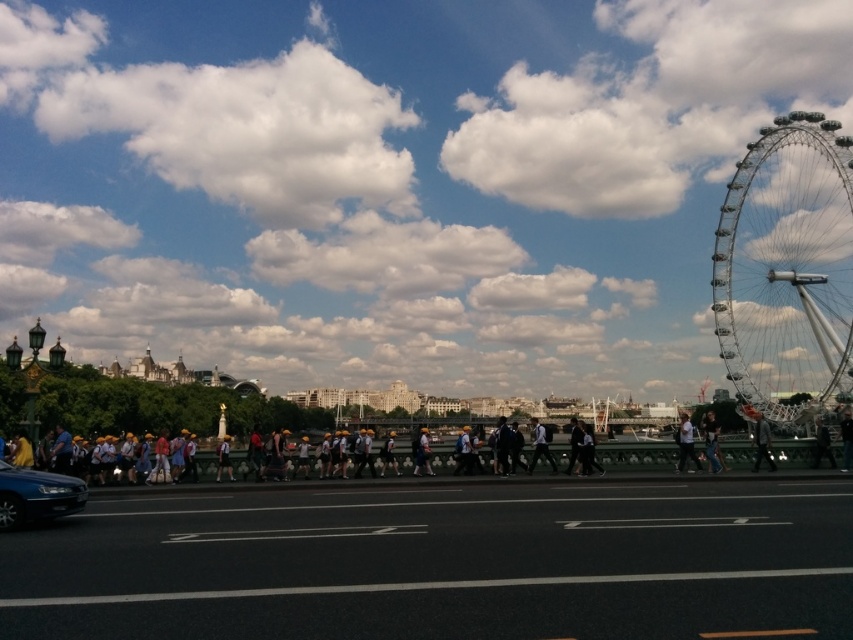
Question: Which of these objects is positioned farthest from the silver metallic ferris wheel at right?

Choices:
 (A) light brown leather jacket at center
 (B) dark blue jeans at center
 (C) shiny blue sedan at lower left

Answer: (C)

Question: Which object appears farthest from the camera in this image?

Choices:
 (A) light blue shirt at center
 (B) dark gray suit at center

Answer: (B)

Question: Observing the image, what is the correct spatial positioning of silver metallic ferris wheel at right in reference to light blue shirt at center?

Choices:
 (A) right
 (B) left

Answer: (A)

Question: Does dark gray jacket at center have a lesser width compared to dark blue jeans at center?

Choices:
 (A) no
 (B) yes

Answer: (A)

Question: Can you confirm if silver metallic ferris wheel at right is positioned to the left of light blue shirt at center?

Choices:
 (A) yes
 (B) no

Answer: (B)

Question: Which object is closer to the camera taking this photo?

Choices:
 (A) light brown leather jacket at center
 (B) dark gray jacket at center
 (C) dark gray suit at center

Answer: (B)